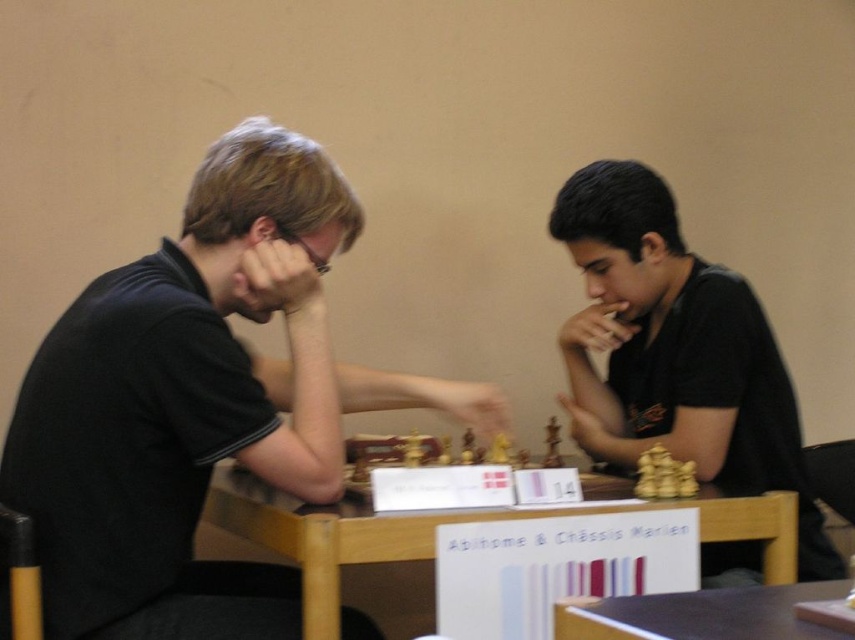
You are a photographer at a chess tournament and need to capture a photo of both players. Since you want to ensure both the black matte shirt at left and the black matte shirt at center are clearly visible in the frame, which one should you focus on first to account for their heights?

The black matte shirt at left is taller than the black matte shirt at center, so you should focus on the black matte shirt at left first to ensure proper depth of field for both players.

You are organizing a chess tournament and need to place a trophy on the table where the wooden at center and wooden chess set at center are located. Which object should the trophy be placed closer to if you want it to be near the larger object?

The wooden at center is larger than the wooden chess set at center, so the trophy should be placed closer to the wooden at center.

You are a photographer standing at the camera position. You want to place a small sticker on the chessboard at point (299, 524). The sticker has a diameter of 0.5 meters. Will the sticker fit entirely within the chessboard?

The point (299, 524) is 1.12 meters away from the camera. Since the sticker has a diameter of 0.5 meters, it will fit entirely within the chessboard as long as the chessboard is large enough to accommodate it. However, without knowing the chessboard dimensions, we can only confirm the distance from the camera to the point, not the board size.